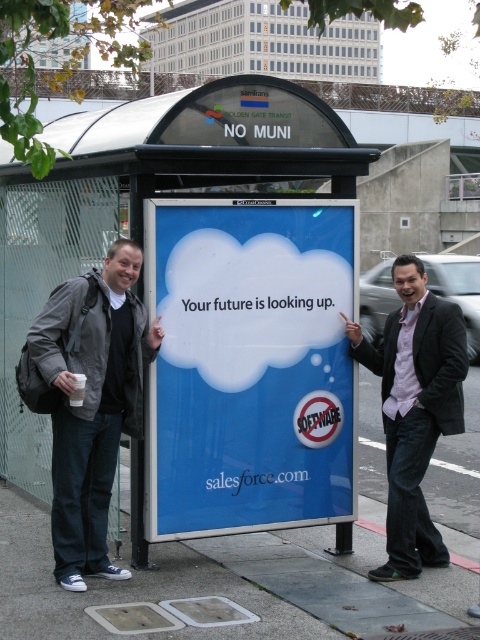
Does blue glossy sign at center have a greater height compared to gray fabric jacket at left?

Yes.

Is point (202, 113) less distant than point (85, 460)?

No, it is behind (85, 460).

Identify the location of blue glossy sign at center. pyautogui.click(x=163, y=173).

Who is positioned more to the right, gray fabric jacket at left or pink shirt at center?

pink shirt at center is more to the right.

Can you confirm if gray fabric jacket at left is positioned to the right of pink shirt at center?

No, gray fabric jacket at left is not to the right of pink shirt at center.

Where is `gray fabric jacket at left`? Image resolution: width=480 pixels, height=640 pixels. gray fabric jacket at left is located at coordinates (93, 403).

Can you confirm if blue matte signboard at center is positioned above blue glossy sign at center?

No, blue matte signboard at center is not above blue glossy sign at center.

Between blue matte signboard at center and blue glossy sign at center, which one has less height?

blue matte signboard at center is shorter.

The image size is (480, 640). Describe the element at coordinates (250, 364) in the screenshot. I see `blue matte signboard at center` at that location.

In order to click on blue matte signboard at center in this screenshot , I will do `click(250, 364)`.